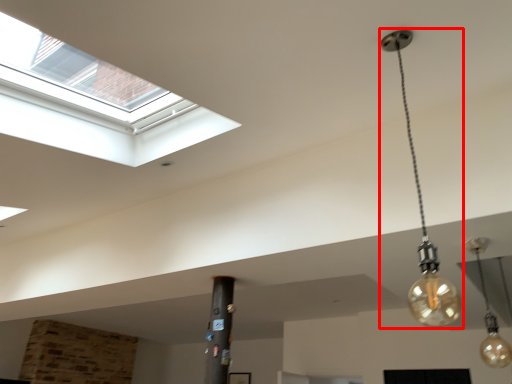
Question: From the image's perspective, where is lamp (annotated by the red box) located in relation to lamp in the image?

Choices:
 (A) below
 (B) above

Answer: (B)